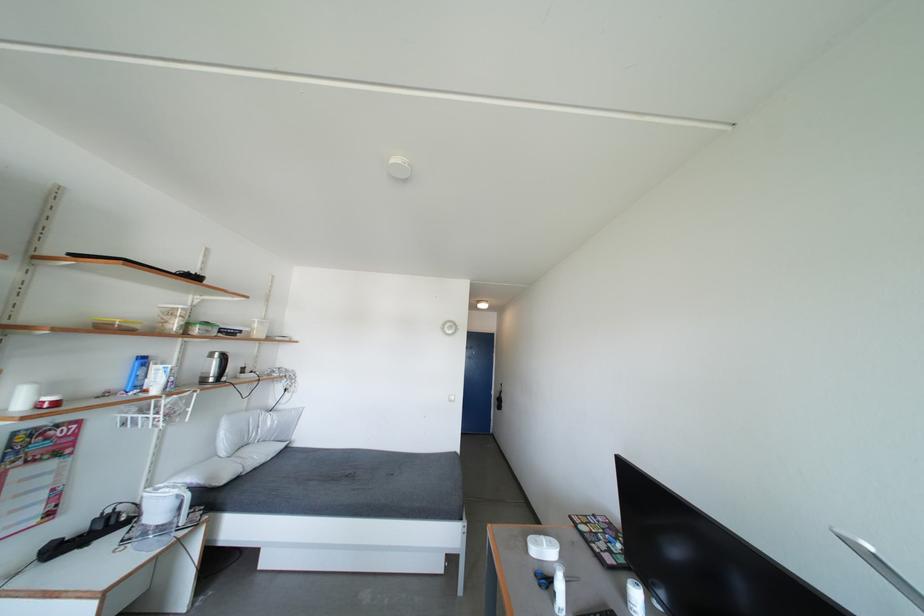
At what (x,y) coordinates should I click in order to perform the action: click on white bottle. Please return your answer as a coordinate pair (x, y). This screenshot has width=924, height=616. Looking at the image, I should click on (558, 590).